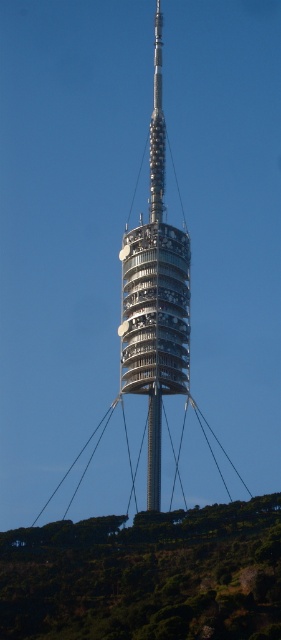
Between point (48, 624) and point (155, 488), which one is positioned in front?

Positioned in front is point (48, 624).

Locate an element on the screen. The width and height of the screenshot is (281, 640). green leafy hillside at lower center is located at coordinates (146, 576).